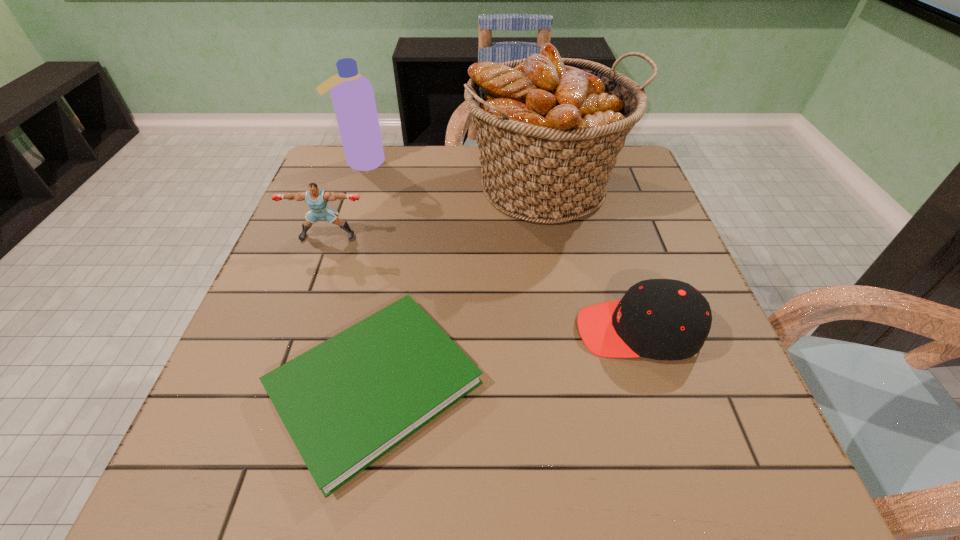
At what (x,y) coordinates should I click in order to perform the action: click on free space between the basket and the shampoo. Please return your answer as a coordinate pair (x, y). Looking at the image, I should click on (455, 174).

The height and width of the screenshot is (540, 960). In order to click on vacant area that lies between the basket and the fourth tallest object in this screenshot , I will do `click(593, 259)`.

You are a GUI agent. You are given a task and a screenshot of the screen. Output one action in this format:
    pyautogui.click(x=<x>, y=<y>)
    Task: Click on the vacant space that's between the shortest object and the second shortest object
    
    Given the screenshot: What is the action you would take?
    [x=506, y=357]

At what (x,y) coordinates should I click in order to perform the action: click on free area in between the second shortest object and the shortest object. Please return your answer as a coordinate pair (x, y). Looking at the image, I should click on (506, 357).

Locate an element on the screen. This screenshot has height=540, width=960. empty space that is in between the third tallest object and the shortest object is located at coordinates (351, 310).

This screenshot has width=960, height=540. Find the location of `vacant area between the shampoo and the basket`. vacant area between the shampoo and the basket is located at coordinates pos(455,174).

The width and height of the screenshot is (960, 540). Identify the location of free area in between the paperback book and the basket. coord(461,286).

Locate an element on the screen. The height and width of the screenshot is (540, 960). empty space that is in between the basket and the second tallest object is located at coordinates (455, 174).

Point out which object is positioned as the fourth nearest to the paperback book. Please provide its 2D coordinates. Your answer should be formatted as a tuple, i.e. [(x, y)], where the tuple contains the x and y coordinates of a point satisfying the conditions above.

[(352, 94)]

Locate an element on the screen. The image size is (960, 540). object identified as the fourth closest to the puncher is located at coordinates (662, 319).